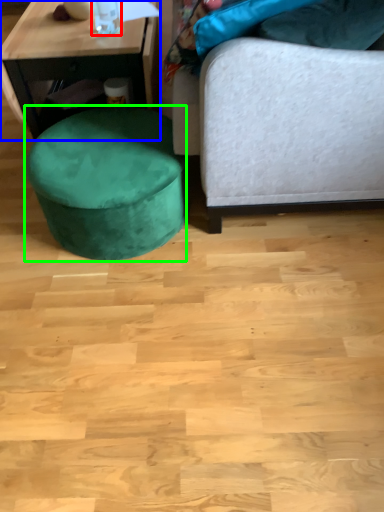
Question: Based on their relative distances, which object is farther from bottle (highlighted by a red box)? Choose from table (highlighted by a blue box) and music stool (highlighted by a green box).

Choices:
 (A) table
 (B) music stool

Answer: (B)